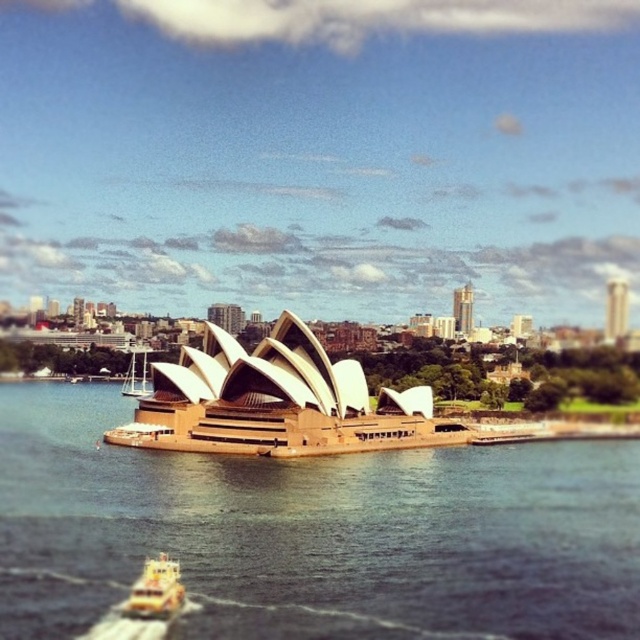
You are a tourist standing on the dock and looking at the brown water at center and the golden stone opera house at center. Which object is positioned to the right of the other?

The brown water at center is to the right of the golden stone opera house at center.

You are standing on a pier overlooking Sydney Harbour and see the brown water at center and the yellow plastic boat at lower left. Which object is nearer to you?

The brown water at center is closer to the viewer than the yellow plastic boat at lower left.